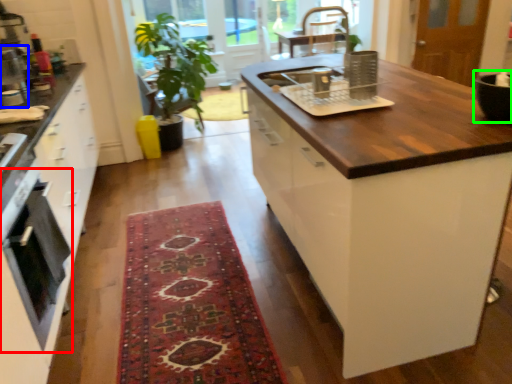
Question: Which object is positioned closest to oven (highlighted by a red box)? Select from appliance (highlighted by a blue box) and appliance (highlighted by a green box).

Choices:
 (A) appliance
 (B) appliance

Answer: (A)